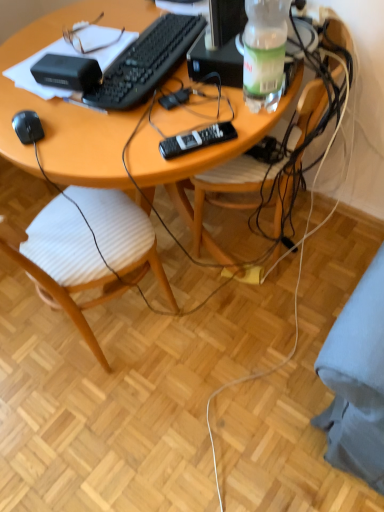
Question: Is wooden desk at center in front of or behind black matte computer mouse at lower left in the image?

Choices:
 (A) front
 (B) behind

Answer: (A)

Question: Would you say wooden desk at center is to the left or to the right of black matte computer mouse at lower left in the picture?

Choices:
 (A) right
 (B) left

Answer: (A)

Question: Which object is positioned closest to the black plastic remote at center?

Choices:
 (A) black matte keyboard at center
 (B) wooden chair at center, the first chair from the right
 (C) wooden desk at center
 (D) black matte computer mouse at lower left
 (E) clear plastic bottle at upper right

Answer: (E)

Question: Based on their relative distances, which object is farther from the wooden chair at center, marked as the first chair in a left-to-right arrangement?

Choices:
 (A) wooden desk at center
 (B) black matte computer mouse at lower left
 (C) clear plastic bottle at upper right
 (D) wooden chair at center, the first chair from the right
 (E) black matte keyboard at center

Answer: (C)